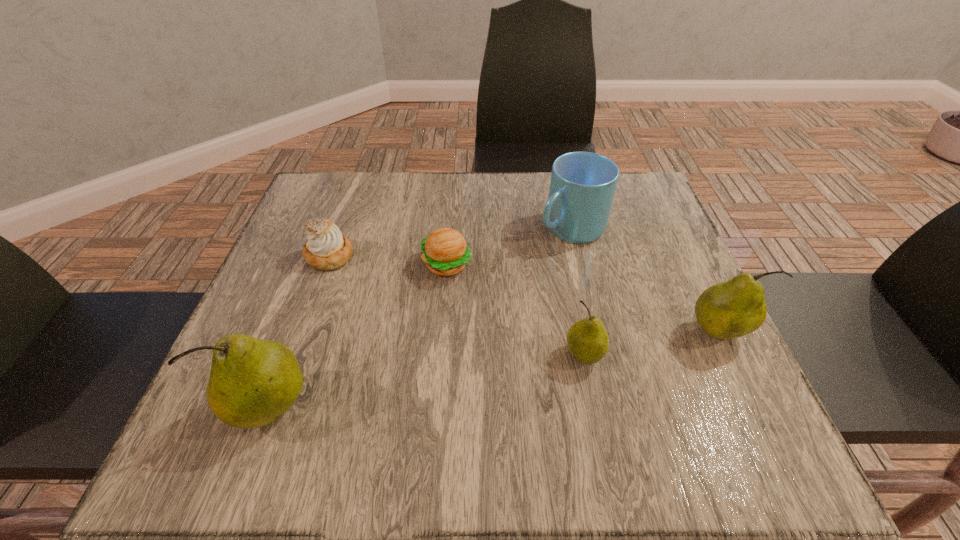
The image size is (960, 540). I want to click on the leftmost pear, so click(x=252, y=382).

Where is `the nearest pear`? the nearest pear is located at coordinates (252, 382).

This screenshot has width=960, height=540. Find the location of `the shortest pear`. the shortest pear is located at coordinates (587, 339).

Find the location of a particular element. This screenshot has height=540, width=960. the rightmost object is located at coordinates (732, 309).

The image size is (960, 540). What are the coordinates of `the rightmost pear` in the screenshot? It's located at (732, 309).

Locate an element on the screen. hamburger is located at coordinates (445, 252).

Locate an element on the screen. This screenshot has height=540, width=960. mug is located at coordinates (582, 187).

Locate an element on the screen. pastry is located at coordinates (326, 248).

Where is `free point located on the right of the leftmost pear`? Image resolution: width=960 pixels, height=540 pixels. free point located on the right of the leftmost pear is located at coordinates (372, 408).

Identify the location of blank space located 0.280m on the back of the shortest pear. (561, 241).